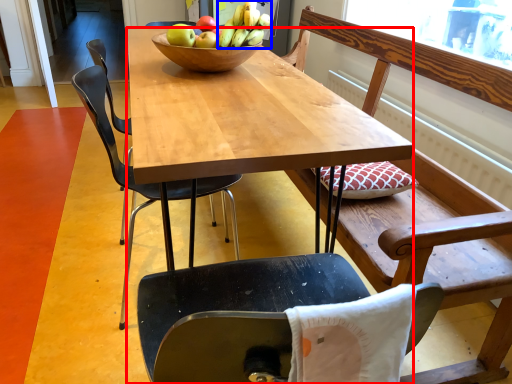
Question: Which object appears closest to the camera in this image, desk (highlighted by a red box) or banana (highlighted by a blue box)?

Choices:
 (A) desk
 (B) banana

Answer: (A)